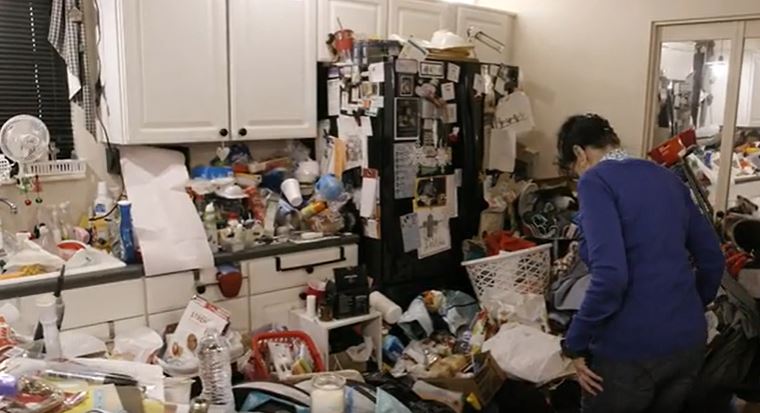
Find the location of `basket`. basket is located at coordinates (261, 341), (496, 278).